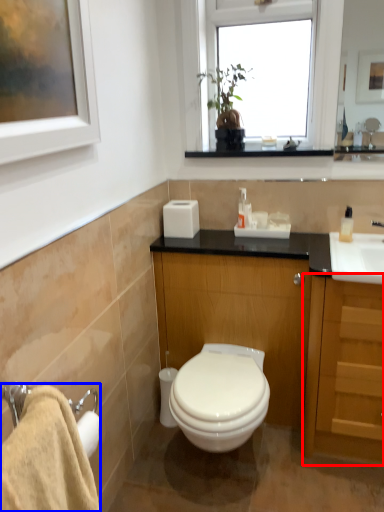
Question: Which object is closer to the camera taking this photo, cabinetry (highlighted by a red box) or bath towel (highlighted by a blue box)?

Choices:
 (A) cabinetry
 (B) bath towel

Answer: (B)